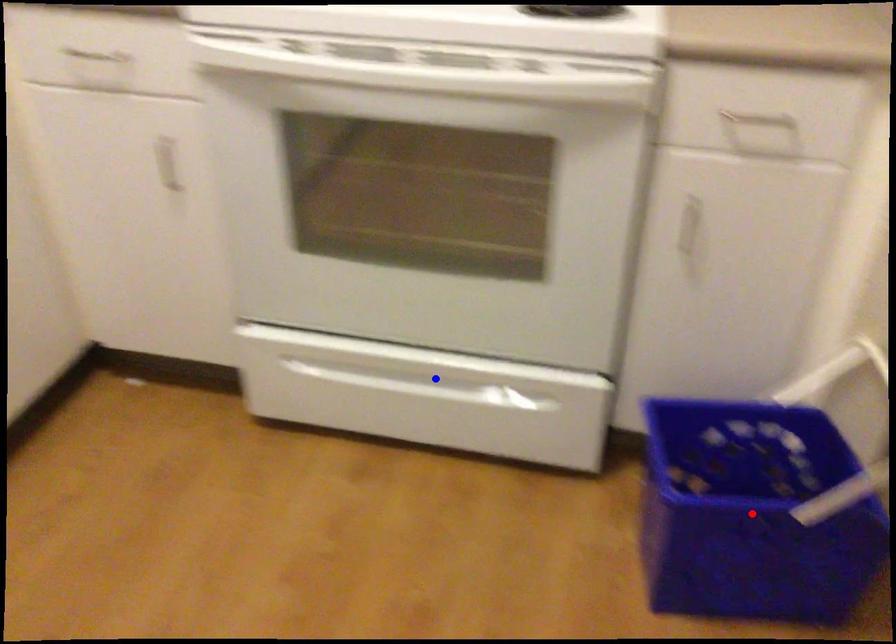
Question: Two points are marked on the image. Which point is closer to the camera?

Choices:
 (A) Blue point is closer.
 (B) Red point is closer.

Answer: (B)